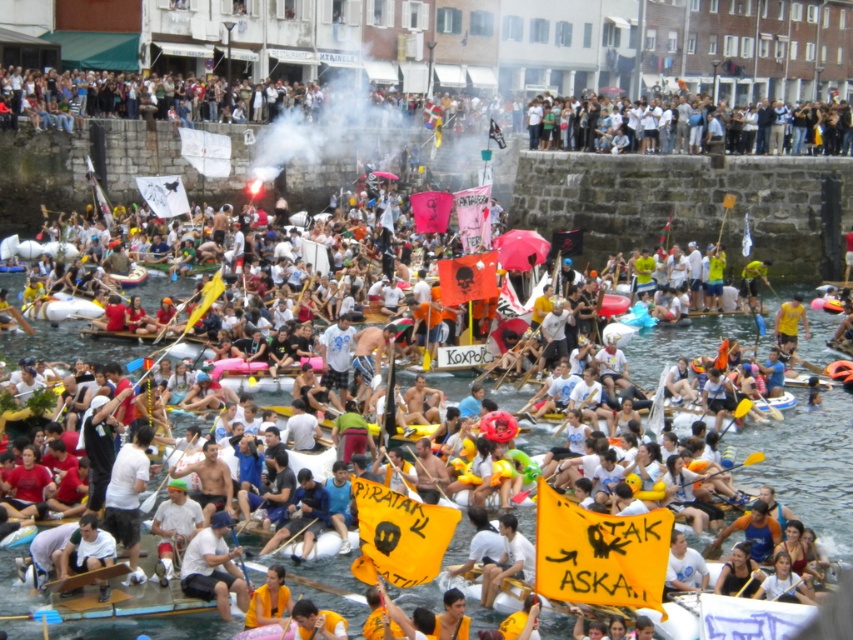
Can you confirm if white cotton crowd at upper center is positioned to the left of white fabric shirt at center?

Incorrect, white cotton crowd at upper center is not on the left side of white fabric shirt at center.

Who is higher up, white cotton crowd at upper center or white fabric shirt at center?

white cotton crowd at upper center is higher up.

Describe the element at coordinates (141, 99) in the screenshot. I see `white cotton crowd at upper center` at that location.

The image size is (853, 640). Find the location of `white cotton crowd at upper center`. white cotton crowd at upper center is located at coordinates (141, 99).

Can you confirm if white cotton crowd at upper center is positioned to the right of yellow fabric paddle at center?

Correct, you'll find white cotton crowd at upper center to the right of yellow fabric paddle at center.

Who is lower down, white cotton crowd at upper center or yellow fabric paddle at center?

yellow fabric paddle at center is lower down.

This screenshot has height=640, width=853. Identify the location of white cotton crowd at upper center. (141, 99).

Describe the element at coordinates (213, 566) in the screenshot. I see `white fabric shirt at center` at that location.

This screenshot has height=640, width=853. Find the location of `white fabric shirt at center`. white fabric shirt at center is located at coordinates (213, 566).